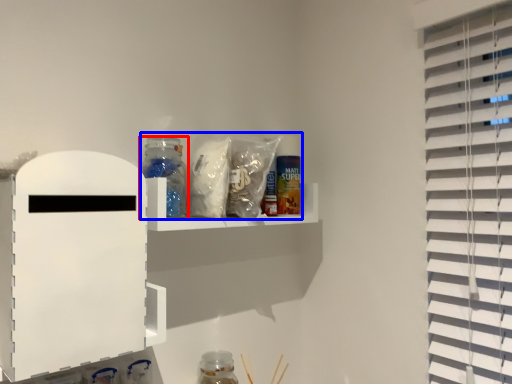
Question: Which object is closer to the camera taking this photo, bottle (highlighted by a red box) or food (highlighted by a blue box)?

Choices:
 (A) bottle
 (B) food

Answer: (B)